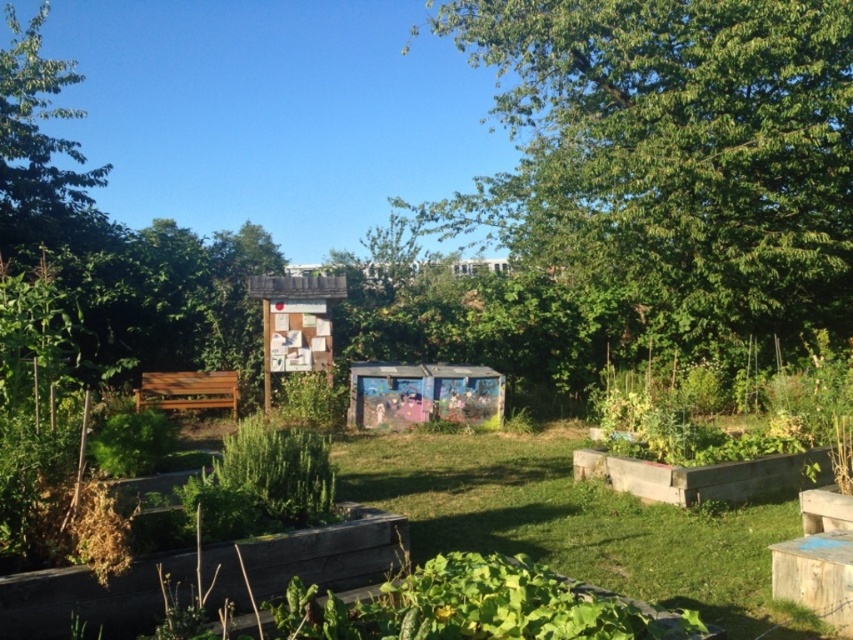
Question: Which point is closer to the camera?

Choices:
 (A) green grass at center
 (B) green leafy tree at upper center

Answer: (A)

Question: Can you confirm if green leafy tree at upper center is smaller than green grass at center?

Choices:
 (A) yes
 (B) no

Answer: (B)

Question: Is green leafy tree at upper center to the left of green leafy tree at upper left from the viewer's perspective?

Choices:
 (A) yes
 (B) no

Answer: (B)

Question: Is green leafy tree at upper center in front of green grass at center?

Choices:
 (A) no
 (B) yes

Answer: (A)

Question: Which point is closer to the camera?

Choices:
 (A) (36, 54)
 (B) (735, 541)

Answer: (B)

Question: Which point is closer to the camera taking this photo?

Choices:
 (A) (569, 460)
 (B) (27, 67)

Answer: (A)